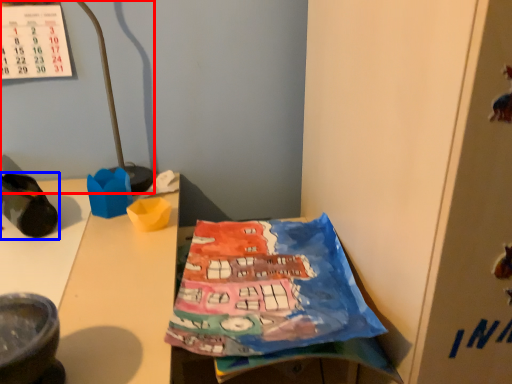
Question: Which object appears farthest to the camera in this image, lamp (highlighted by a red box) or footwear (highlighted by a blue box)?

Choices:
 (A) lamp
 (B) footwear

Answer: (A)